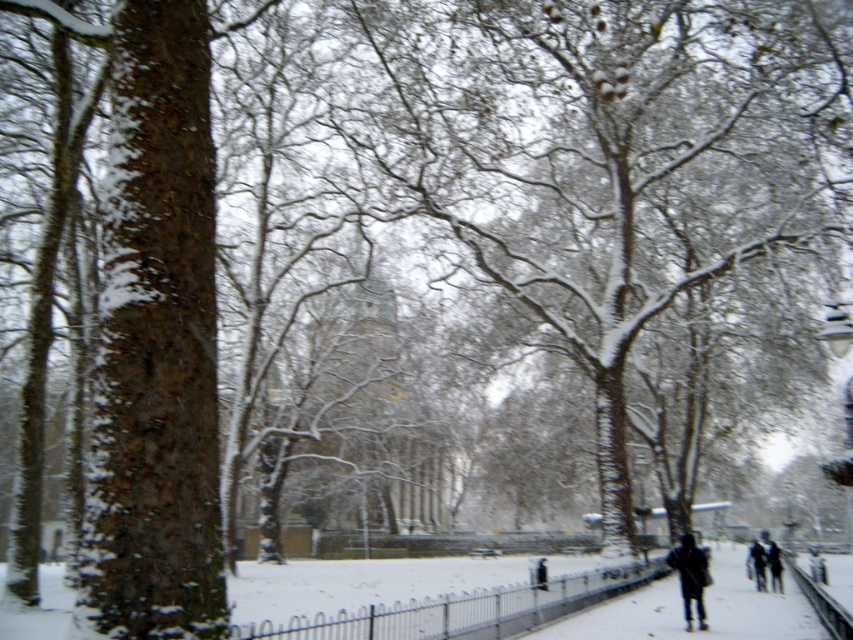
You are standing on the snowy pathway and see two people wearing jackets. One has a dark blue jacket at lower right and the other has a dark gray jacket at lower right. Which jacket is positioned higher up relative to the other?

The dark blue jacket at lower right is located above the dark gray jacket at lower right, so it is positioned higher up.

You are standing at the point labeled point (785, 608) and want to walk to point (753, 564). Which direction should you move to get closer to your destination?

You should move away from the viewer because point (753, 564) is further away from the viewer than point (785, 608).